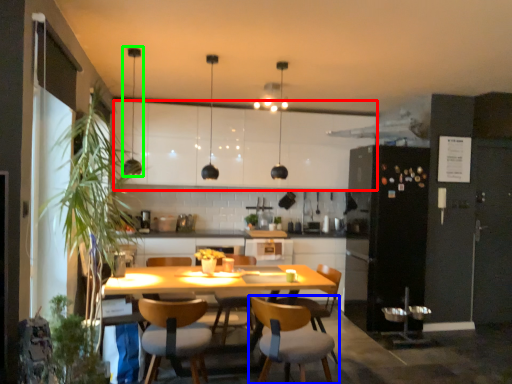
Question: Based on their relative distances, which object is nearer to cabinetry (highlighted by a red box)? Choose from chair (highlighted by a blue box) and light fixture (highlighted by a green box).

Choices:
 (A) chair
 (B) light fixture

Answer: (B)